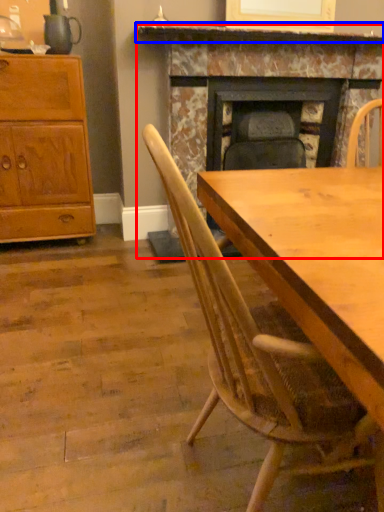
Question: Which point is closer to the camera, fireplace (highlighted by a red box) or mantle (highlighted by a blue box)?

Choices:
 (A) fireplace
 (B) mantle

Answer: (B)